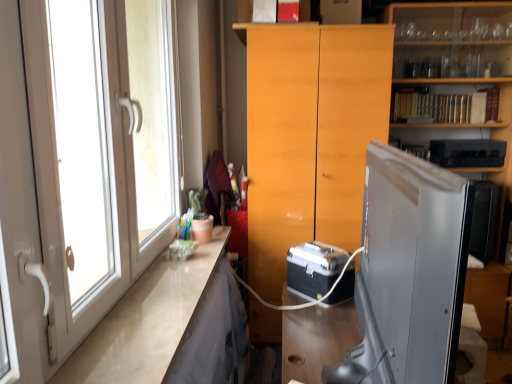
Question: From a real-world perspective, is metallic silver briefcase at center, which is counted as the 1th appliance, starting from the left, physically located above or below black plastic microwave at upper right, the 2th appliance when ordered from left to right?

Choices:
 (A) above
 (B) below

Answer: (B)

Question: Is point (344, 264) closer or farther from the camera than point (437, 155)?

Choices:
 (A) farther
 (B) closer

Answer: (B)

Question: Considering the real-world distances, which object is farthest from the black plastic microwave at upper right, acting as the 2th appliance starting from the bottom?

Choices:
 (A) light wood cabinet at center
 (B) white glossy counter top at left
 (C) metallic silver briefcase at center, the second appliance viewed from the right
 (D) wooden bookshelf at upper right
 (E) white glossy door at left

Answer: (E)

Question: Which object is positioned closest to the metallic silver briefcase at center, which is the 2th appliance from top to bottom?

Choices:
 (A) white glossy counter top at left
 (B) white glossy door at left
 (C) light wood cabinet at center
 (D) wooden bookshelf at upper right
 (E) black plastic microwave at upper right, arranged as the 1th appliance when viewed from the top

Answer: (C)